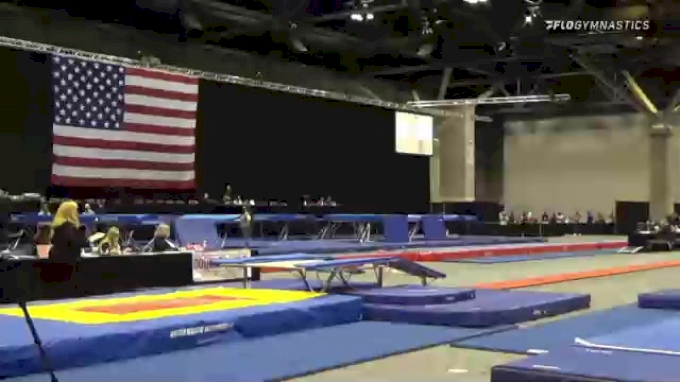
Find the location of a particular element. blue mats is located at coordinates (273, 369), (46, 337), (663, 335), (591, 324).